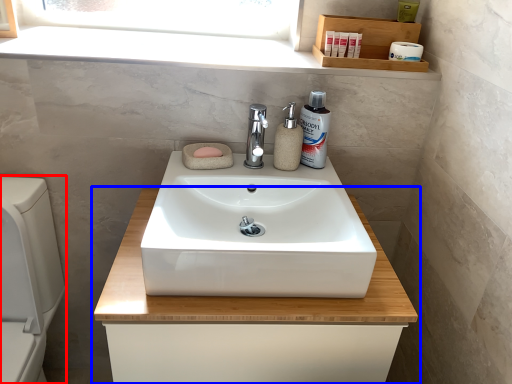
Question: Which of the following is the farthest to the observer, appliance (highlighted by a red box) or bathroom cabinet (highlighted by a blue box)?

Choices:
 (A) appliance
 (B) bathroom cabinet

Answer: (B)